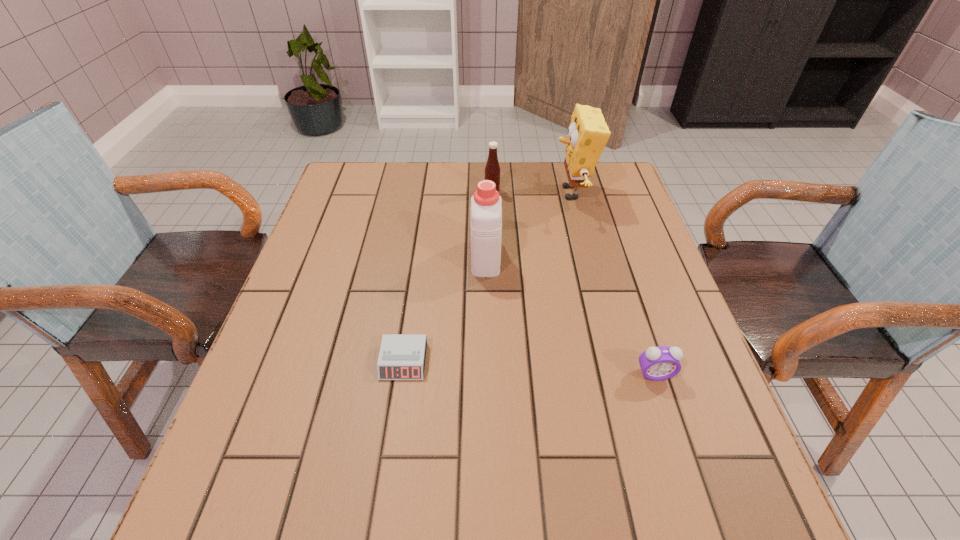
Locate an element on the screen. The width and height of the screenshot is (960, 540). sponge is located at coordinates (588, 133).

Image resolution: width=960 pixels, height=540 pixels. In order to click on the third nearest object in this screenshot , I will do `click(486, 205)`.

Locate an element on the screen. This screenshot has height=540, width=960. Tabasco sauce is located at coordinates (492, 169).

The image size is (960, 540). In order to click on the right alarm clock in this screenshot , I will do `click(658, 363)`.

Identify the location of the fourth tallest object. The width and height of the screenshot is (960, 540). (658, 363).

What are the coordinates of `the shortest object` in the screenshot? It's located at (402, 356).

This screenshot has height=540, width=960. I want to click on the leftmost object, so click(402, 356).

The height and width of the screenshot is (540, 960). I want to click on vacant space located on the face of the sponge, so click(x=434, y=193).

Locate an element on the screen. The image size is (960, 540). vacant point located 0.370m on the face of the sponge is located at coordinates (x=427, y=193).

The height and width of the screenshot is (540, 960). I want to click on vacant position located on the face of the sponge, so click(497, 193).